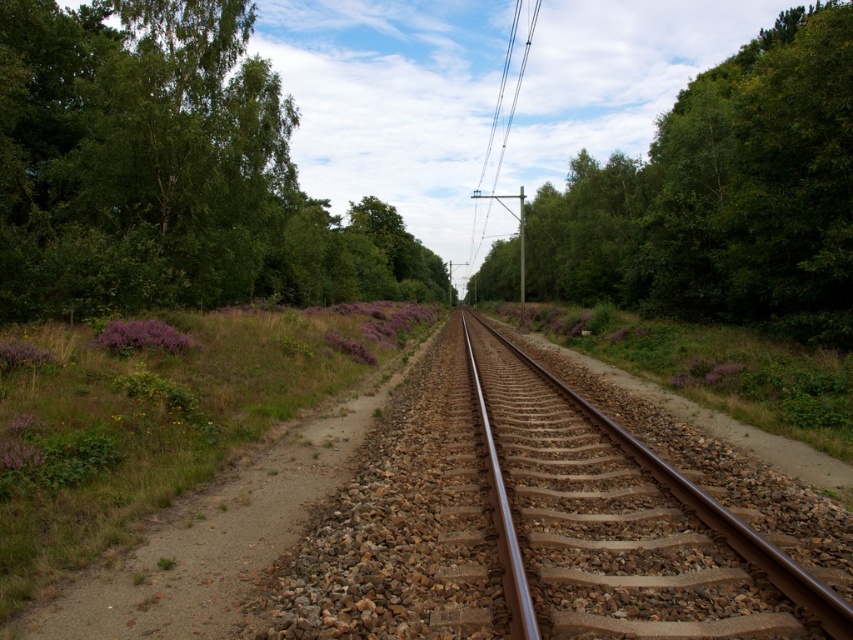
Who is more distant from viewer, (53, 86) or (476, 234)?

The point (476, 234) is behind.

This screenshot has width=853, height=640. In order to click on green leafy tree at upper left in this screenshot , I will do `click(167, 172)`.

Between point (10, 96) and point (479, 193), which one is positioned in front?

Positioned in front is point (10, 96).

You are a GUI agent. You are given a task and a screenshot of the screen. Output one action in this format:
    pyautogui.click(x=<x>, y=<y>)
    Task: Click on the green leafy tree at upper left
    
    Given the screenshot: What is the action you would take?
    pyautogui.click(x=167, y=172)

Does point (625, 246) come closer to viewer compared to point (791, 620)?

No, (625, 246) is behind (791, 620).

Is green leafy tree at upper right positioned at the back of brown metal track at center?

That is True.

Measure the distance between green leafy tree at upper right and camera.

A distance of 48.38 feet exists between green leafy tree at upper right and camera.

At what (x,y) coordinates should I click in order to perform the action: click on green leafy tree at upper right. Please return your answer as a coordinate pair (x, y). Image resolution: width=853 pixels, height=640 pixels. Looking at the image, I should click on (722, 195).

Does green leafy tree at upper left appear on the left side of brown metal track at center?

Yes, green leafy tree at upper left is to the left of brown metal track at center.

Between green leafy tree at upper left and brown metal track at center, which one is positioned lower?

brown metal track at center is lower down.

Which is behind, point (90, 161) or point (668, 637)?

Positioned behind is point (90, 161).

This screenshot has width=853, height=640. I want to click on green leafy tree at upper left, so click(167, 172).